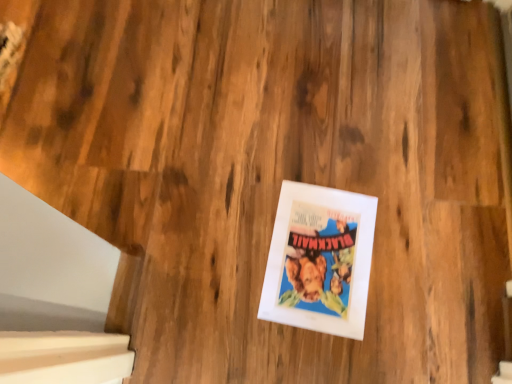
Identify the location of vacant space that is to the left of white matte picture frame at center. This screenshot has width=512, height=384. tap(211, 240).